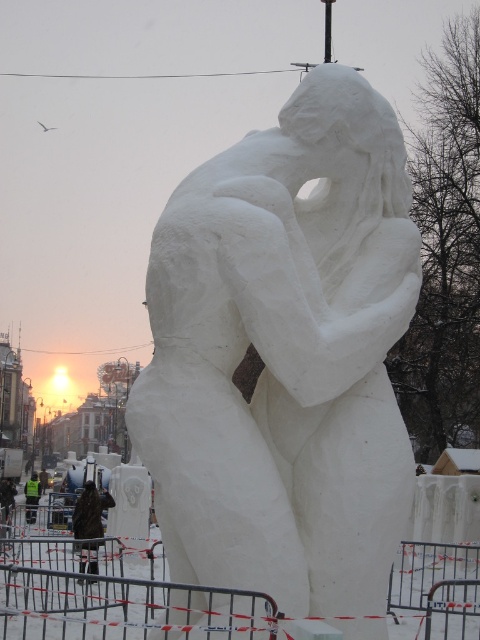
You are a photographer standing at the base of the snow sculpture. You want to capture a clear photo of the green reflective vest at center without the brown fabric jacket at lower left blocking it. What should you do?

Move to the side so that the brown fabric jacket at lower left is no longer in front of the green reflective vest at center. Since the brown fabric jacket at lower left is currently in front, changing your angle will allow you to see the green reflective vest at center clearly.

You are standing at the origin point of the snow sculpture scene. The brown fabric jacket at lower left is located at coordinates point 0.802, 0.188. If you want to reach the jacket, which direction should you move relative to your current position?

The brown fabric jacket at lower left is located at coordinates point (90, 513), so you should move towards the lower left direction to reach it.